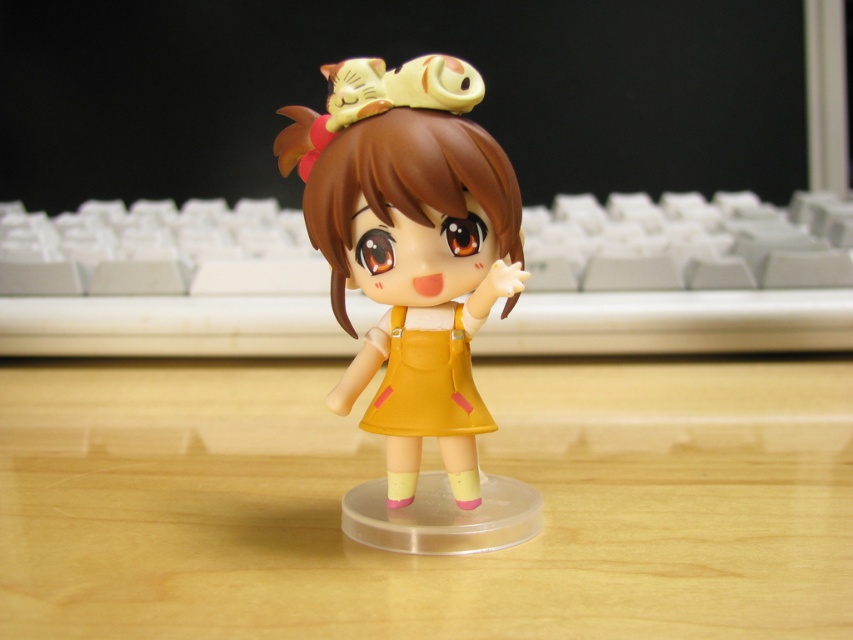
You are organizing a display and want to place a new figurine on the desk. There are two yellow dresses in the scene. Which one is positioned higher, the matte yellow dress at center or the yellow matte dress at center?

The matte yellow dress at center is located above the yellow matte dress at center, so it is positioned higher.

You are positioning a camera to capture the white plastic keyboard at center. The camera can only focus on objects within a circular area with a radius of 0.1 units centered at point A. If point A is at coordinates

The white plastic keyboard at center is located at point [672,280]. If point A is at coordinates

You are standing in front of the wooden table at center. You want to place a small cup exactly at the point marked by point (381, 472). Is this point on the wooden table at center?

Yes, the point (381, 472) marks the wooden table at center, so placing the cup there would be on the wooden table at center.